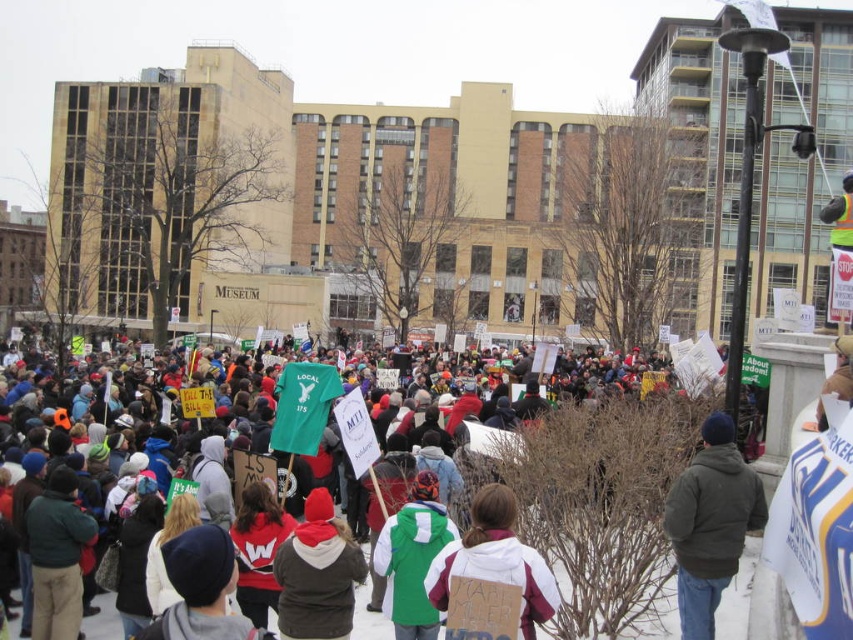
Which is in front, point (648, 467) or point (355, 564)?

Point (355, 564) is more forward.

Does point (148, 506) lie behind point (343, 525)?

That is True.

The width and height of the screenshot is (853, 640). I want to click on multicolored fabric crowd at center, so click(x=598, y=506).

Who is higher up, red knit cap at center or green fleece jacket at center?

green fleece jacket at center is higher up.

Can you confirm if red knit cap at center is bigger than green fleece jacket at center?

Correct, red knit cap at center is larger in size than green fleece jacket at center.

Who is more distant from viewer, (299, 636) or (419, 564)?

Positioned behind is point (419, 564).

The height and width of the screenshot is (640, 853). I want to click on red knit cap at center, so click(317, 573).

Find the location of a particular element. This screenshot has width=853, height=640. green fabric jacket at lower left is located at coordinates (57, 556).

This screenshot has height=640, width=853. What do you see at coordinates (57, 556) in the screenshot?
I see `green fabric jacket at lower left` at bounding box center [57, 556].

This screenshot has height=640, width=853. Find the location of `green fabric jacket at lower left`. green fabric jacket at lower left is located at coordinates (57, 556).